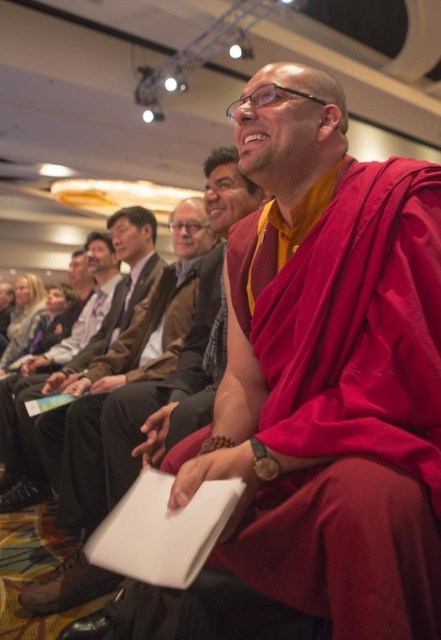
You are organizing a photo shoot and need to place two props, a maroon silk robe at center and a brown leather jacket at center, in a way that aligns with their original positions in the scene. Which prop should be placed to the right of the other?

The maroon silk robe at center should be placed to the right of the brown leather jacket at center because the maroon silk robe at center is positioned on the right side of brown leather jacket at center in the original scene.

You are attending a formal event and notice two people sitting in front of you. One is wearing a maroon silk robe at center and the other is wearing a brown leather jacket at center. Which person is closer to you?

The maroon silk robe at center is closer to you because it is in front of the brown leather jacket at center.